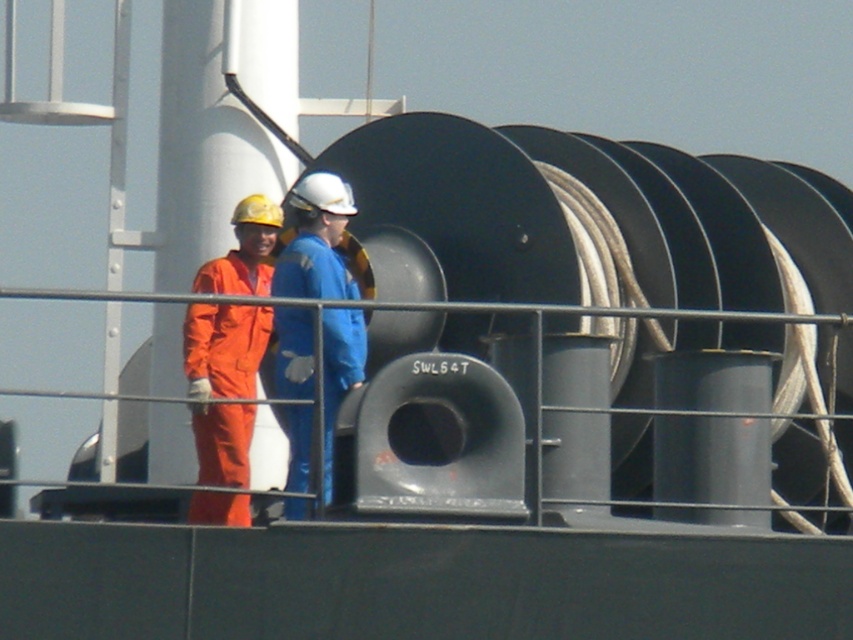
Does orange coveralls at left have a lesser height compared to blue matte coveralls at center?

In fact, orange coveralls at left may be taller than blue matte coveralls at center.

Between orange coveralls at left and blue matte coveralls at center, which one is positioned lower?

orange coveralls at left

Identify the location of orange coveralls at left. This screenshot has width=853, height=640. (224, 348).